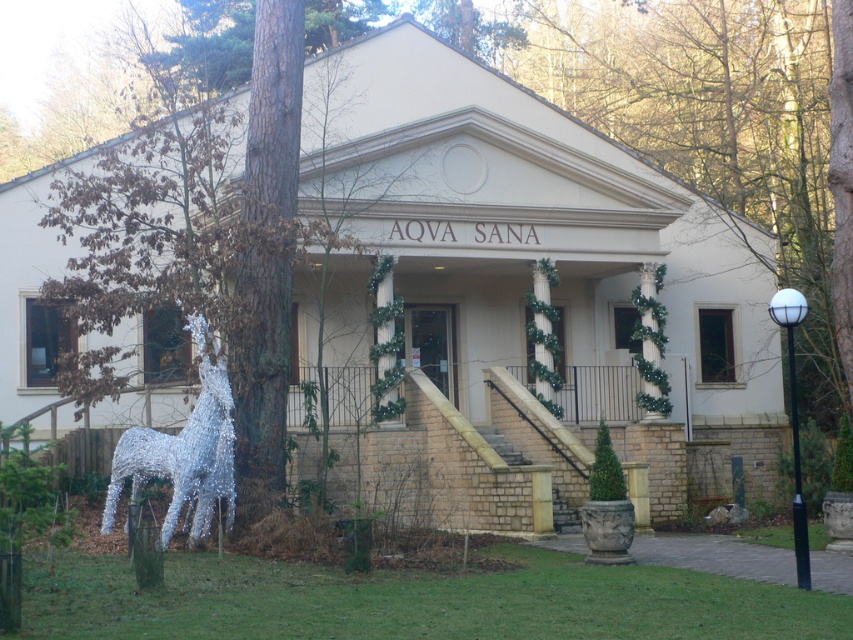
Between brown textured tree at left and silver wire horse at left, which one has more height?

With more height is silver wire horse at left.

Does brown textured tree at left appear over silver wire horse at left?

Yes.

Is point (277, 419) positioned before point (154, 440)?

No.

You are a GUI agent. You are given a task and a screenshot of the screen. Output one action in this format:
    pyautogui.click(x=<x>, y=<y>)
    Task: Click on the brown textured tree at left
    
    Given the screenshot: What is the action you would take?
    pyautogui.click(x=206, y=241)